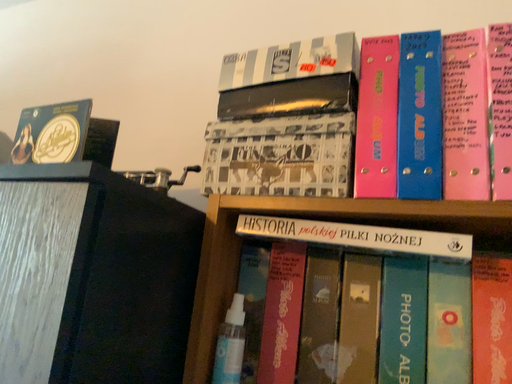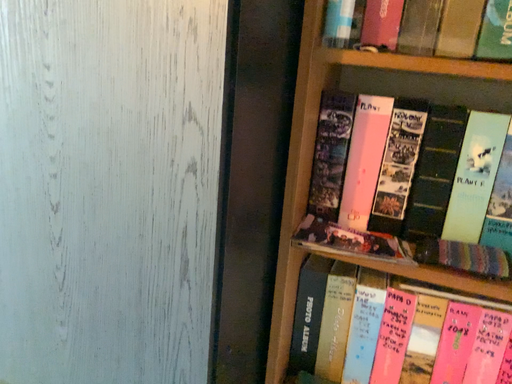
Question: How did the camera likely rotate when shooting the video?

Choices:
 (A) rotated downward
 (B) rotated upward

Answer: (A)